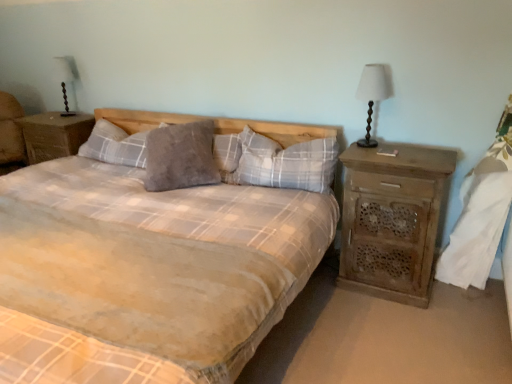
Question: Is rustic wood nightstand at right, the 2th nightstand viewed from the back, taller or shorter than wooden nightstand at left, which is counted as the second nightstand, starting from the front?

Choices:
 (A) tall
 (B) short

Answer: (A)

Question: Which is correct: rustic wood nightstand at right, the 2th nightstand viewed from the back, is inside wooden nightstand at left, which is counted as the second nightstand, starting from the front, or outside of it?

Choices:
 (A) outside
 (B) inside

Answer: (A)

Question: Which object is the closest to the matte wood lamp at right?

Choices:
 (A) wooden nightstand at left, which is counted as the second nightstand, starting from the front
 (B) gray soft pillow at center, which ranks as the 3th pillow in left-to-right order
 (C) rustic wood nightstand at right, the 2th nightstand when ordered from top to bottom
 (D) white fabric at right
 (E) grey fuzzy pillow at center, which ranks as the 2th pillow in right-to-left order

Answer: (B)

Question: Which object is the farthest from the gray soft pillow at center, which ranks as the 3th pillow in left-to-right order?

Choices:
 (A) wooden nightstand at left, which is counted as the second nightstand, starting from the front
 (B) plush gray pillow at center, the first pillow when ordered from left to right
 (C) rustic wood nightstand at right, positioned as the first nightstand in front-to-back order
 (D) matte black table lamp at upper left
 (E) plaid fabric bed at center

Answer: (D)